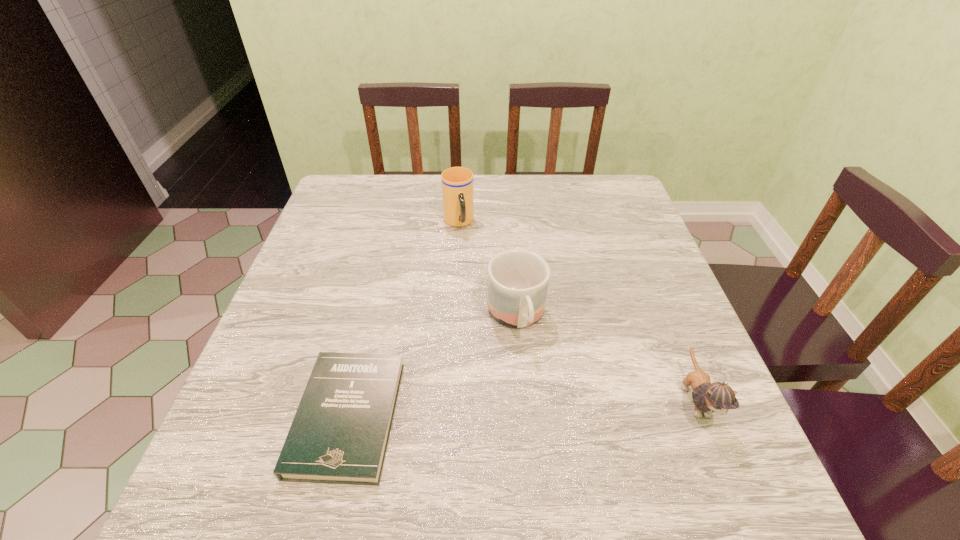
Identify the location of the leftmost object. The height and width of the screenshot is (540, 960). (339, 435).

Identify the location of the shortest object. (339, 435).

This screenshot has height=540, width=960. What are the coordinates of `the rightmost object` in the screenshot? It's located at (718, 397).

Where is `the farthest object`? This screenshot has height=540, width=960. the farthest object is located at coordinates (457, 182).

At what (x,y) coordinates should I click in order to perform the action: click on the third object from right to left. Please return your answer as a coordinate pair (x, y). The height and width of the screenshot is (540, 960). Looking at the image, I should click on (457, 182).

Locate an element on the screen. The height and width of the screenshot is (540, 960). the second farthest object is located at coordinates (518, 280).

At what (x,y) coordinates should I click in order to perform the action: click on mug. Please return your answer as a coordinate pair (x, y). This screenshot has width=960, height=540. Looking at the image, I should click on (518, 280).

You are a GUI agent. You are given a task and a screenshot of the screen. Output one action in this format:
    pyautogui.click(x=<x>, y=<y>)
    Task: Click on the vacant space situated 0.190m on the right of the leftmost object
    The width and height of the screenshot is (960, 540).
    Given the screenshot: What is the action you would take?
    pyautogui.click(x=501, y=417)

The width and height of the screenshot is (960, 540). What are the coordinates of `vacant space located on the side of the farthest object with the handle` in the screenshot? It's located at point(468,256).

Image resolution: width=960 pixels, height=540 pixels. Identify the location of vacant space located on the side of the farthest object with the handle. (479, 286).